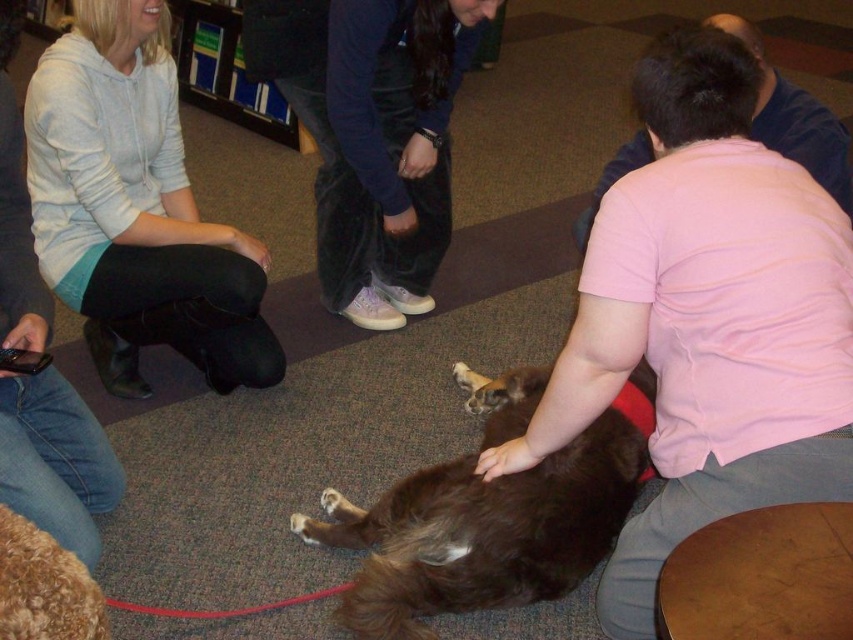
Question: Does pink cotton shirt at lower right lie in front of light blue hoodie at upper left?

Choices:
 (A) yes
 (B) no

Answer: (A)

Question: Considering the real-world distances, which object is farthest from the light blue hoodie at upper left?

Choices:
 (A) brown furry dog at center
 (B) curly golden fur dog at lower left
 (C) pink cotton shirt at lower right

Answer: (B)

Question: Which object is the farthest from the light blue hoodie at upper left?

Choices:
 (A) brown furry dog at center
 (B) pink cotton shirt at lower right
 (C) curly golden fur dog at lower left

Answer: (C)

Question: Does light blue hoodie at upper left come behind curly golden fur dog at lower left?

Choices:
 (A) no
 (B) yes

Answer: (B)

Question: Which point is closer to the camera taking this photo?

Choices:
 (A) (228, 374)
 (B) (10, 548)
 (C) (663, 230)

Answer: (B)

Question: Is pink cotton shirt at lower right positioned at the back of brown furry dog at center?

Choices:
 (A) yes
 (B) no

Answer: (B)